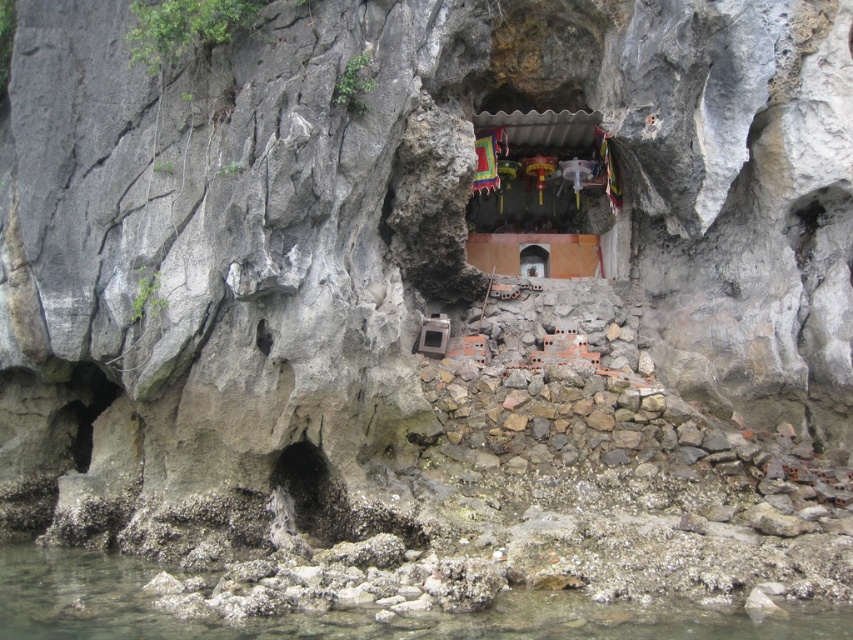
Which is above, clear water at lower left or matte stone altar at center?

Positioned higher is matte stone altar at center.

Is clear water at lower left shorter than matte stone altar at center?

Yes.

Locate an element on the screen. clear water at lower left is located at coordinates (350, 611).